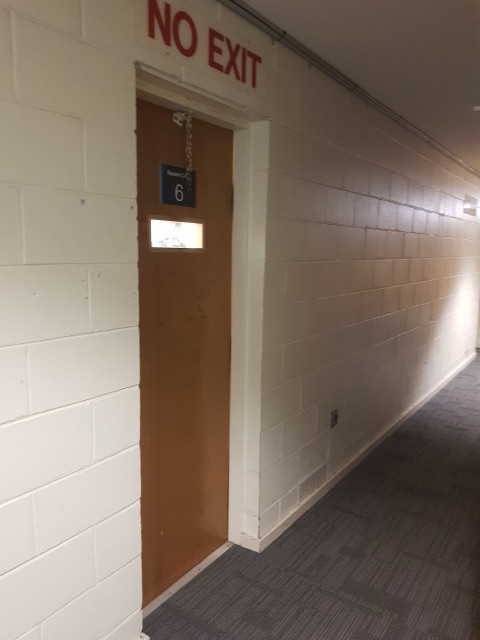
Where is `ceiling`? The height and width of the screenshot is (640, 480). ceiling is located at coordinates (401, 24).